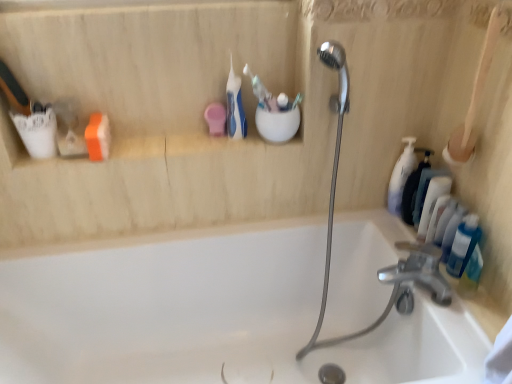
At what (x,y) coordinates should I click in order to perform the action: click on free space to the left of blue plastic toothbrush at center, the 3th toothbrush in the right-to-left sequence. Please return your answer as a coordinate pair (x, y). Looking at the image, I should click on (184, 149).